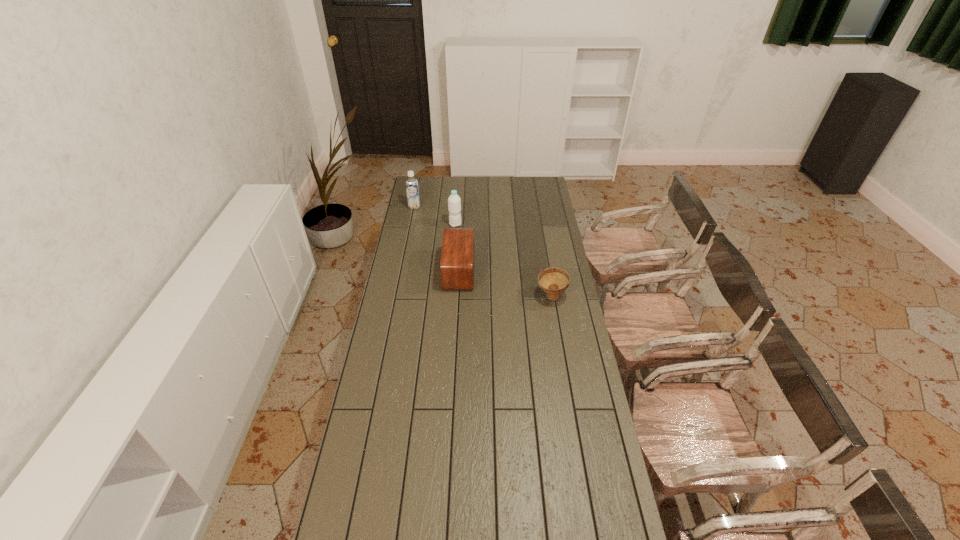
Where is `the leftmost object`? The width and height of the screenshot is (960, 540). the leftmost object is located at coordinates (412, 189).

Where is `the farthest object`? the farthest object is located at coordinates (412, 189).

Find the location of a particular element. water bottle is located at coordinates (454, 201).

You are a GUI agent. You are given a task and a screenshot of the screen. Output one action in this format:
    pyautogui.click(x=<x>, y=<y>)
    Task: Click on the radio receiver
    This screenshot has height=540, width=960.
    Given the screenshot: What is the action you would take?
    pyautogui.click(x=457, y=257)

Find the location of `soup bowl`. soup bowl is located at coordinates (553, 281).

Where is `the rightmost object`? The image size is (960, 540). the rightmost object is located at coordinates (553, 281).

This screenshot has height=540, width=960. Find the location of `vacant space positioned on the label of the leftmost object`. vacant space positioned on the label of the leftmost object is located at coordinates (409, 232).

Where is `vacant space situated on the back of the second farthest object`? This screenshot has width=960, height=540. vacant space situated on the back of the second farthest object is located at coordinates (458, 195).

Identify the location of vacant space situated 0.250m on the front panel of the radio receiver. The height and width of the screenshot is (540, 960). tap(525, 271).

The width and height of the screenshot is (960, 540). Find the location of `vacant region located 0.150m on the left of the soup bowl`. vacant region located 0.150m on the left of the soup bowl is located at coordinates click(503, 296).